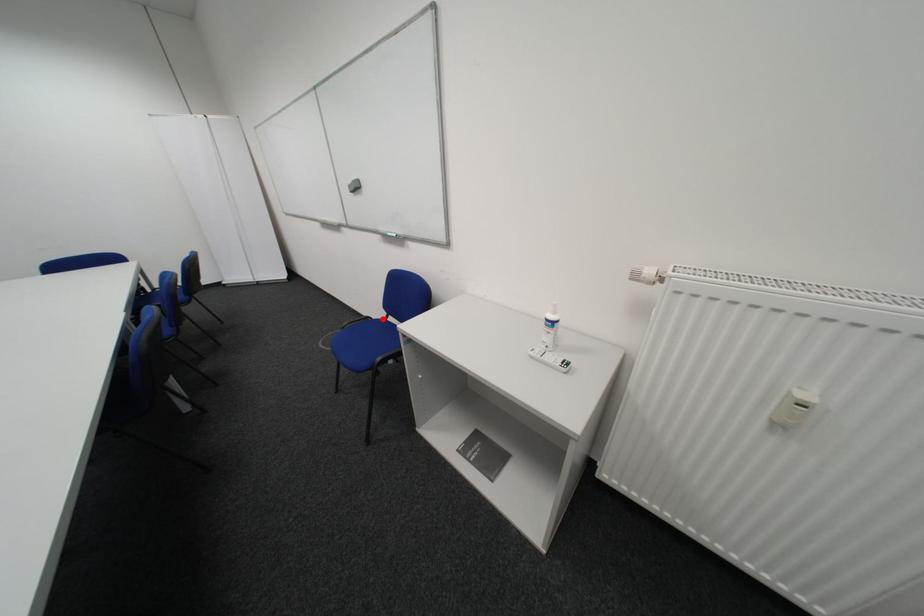
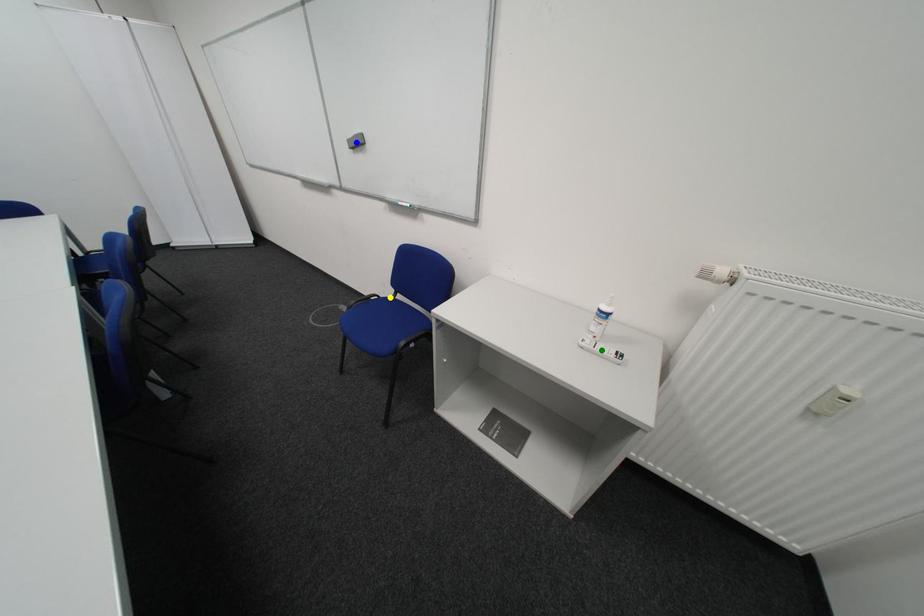
Question: I am providing you with two images of the same scene from different viewpoints. A red point is marked on the first image. You are given multiple points on the second image. Which point in image 2 is actually the same real-world point as the red point in image 1?

Choices:
 (A) green point
 (B) yellow point
 (C) blue point

Answer: (B)